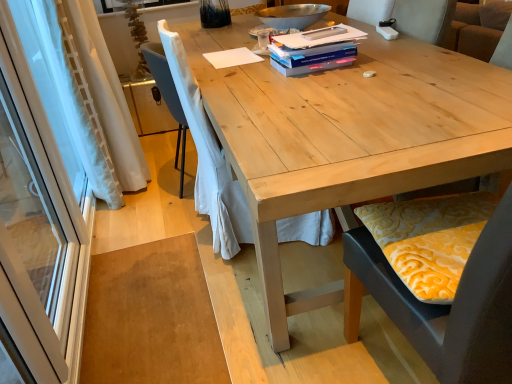
Question: Can you confirm if blue matte paperback book at upper center, the 1th paperback book from the top, is smaller than white plastic remote control at upper center?

Choices:
 (A) yes
 (B) no

Answer: (B)

Question: Does blue matte paperback book at upper center, the 1th paperback book from the top, lie behind white plastic remote control at upper center?

Choices:
 (A) no
 (B) yes

Answer: (A)

Question: From the image's perspective, does blue matte paperback book at upper center, the 1th paperback book from the top, appear higher than white plastic remote control at upper center?

Choices:
 (A) no
 (B) yes

Answer: (A)

Question: Is blue matte paperback book at upper center, the 1th paperback book from the top, not inside white plastic remote control at upper center?

Choices:
 (A) yes
 (B) no

Answer: (A)

Question: From a real-world perspective, is blue matte paperback book at upper center, the 1th paperback book from the top, beneath white plastic remote control at upper center?

Choices:
 (A) no
 (B) yes

Answer: (B)

Question: Looking at the image, does blue matte paperback book at center, which is the third paperback book from top to bottom, seem bigger or smaller compared to yellow patterned cushion at lower right, marked as the 2th chair in a left-to-right arrangement?

Choices:
 (A) big
 (B) small

Answer: (B)

Question: From a real-world perspective, relative to yellow patterned cushion at lower right, arranged as the 1th chair when viewed from the front, is blue matte paperback book at center, which is the 1th paperback book in bottom-to-top order, vertically above or below?

Choices:
 (A) above
 (B) below

Answer: (A)

Question: In terms of height, does blue matte paperback book at center, which is the third paperback book from top to bottom, look taller or shorter compared to yellow patterned cushion at lower right, which ranks as the first chair in right-to-left order?

Choices:
 (A) short
 (B) tall

Answer: (A)

Question: From the image's perspective, is blue matte paperback book at center, which is the third paperback book from top to bottom, positioned above or below yellow patterned cushion at lower right, marked as the 2th chair in a left-to-right arrangement?

Choices:
 (A) below
 (B) above

Answer: (B)

Question: From a real-world perspective, is yellow patterned cushion at lower right, which ranks as the first chair in right-to-left order, physically located above or below white fabric chair at center, placed as the 1th chair when sorted from back to front?

Choices:
 (A) above
 (B) below

Answer: (A)

Question: Considering the relative positions of yellow patterned cushion at lower right, marked as the 2th chair in a left-to-right arrangement, and white fabric chair at center, which appears as the 2th chair when viewed from the front, in the image provided, is yellow patterned cushion at lower right, marked as the 2th chair in a left-to-right arrangement, to the left or to the right of white fabric chair at center, which appears as the 2th chair when viewed from the front,?

Choices:
 (A) left
 (B) right

Answer: (B)

Question: From the image's perspective, is yellow patterned cushion at lower right, which ranks as the first chair in right-to-left order, above or below white fabric chair at center, which is counted as the first chair, starting from the left?

Choices:
 (A) below
 (B) above

Answer: (A)

Question: Looking at the image, does yellow patterned cushion at lower right, the 2th chair in the back-to-front sequence, seem bigger or smaller compared to white fabric chair at center, which appears as the 2th chair when viewed from the front?

Choices:
 (A) big
 (B) small

Answer: (B)

Question: In terms of height, does blue matte paperback book at upper center, the 2th paperback book ordered from the bottom, look taller or shorter compared to white sheer curtain at left, the 1th curtain viewed from the back?

Choices:
 (A) tall
 (B) short

Answer: (B)

Question: From a real-world perspective, is blue matte paperback book at upper center, the 2th paperback book ordered from the bottom, positioned above or below white sheer curtain at left, the second curtain in the front-to-back sequence?

Choices:
 (A) above
 (B) below

Answer: (A)